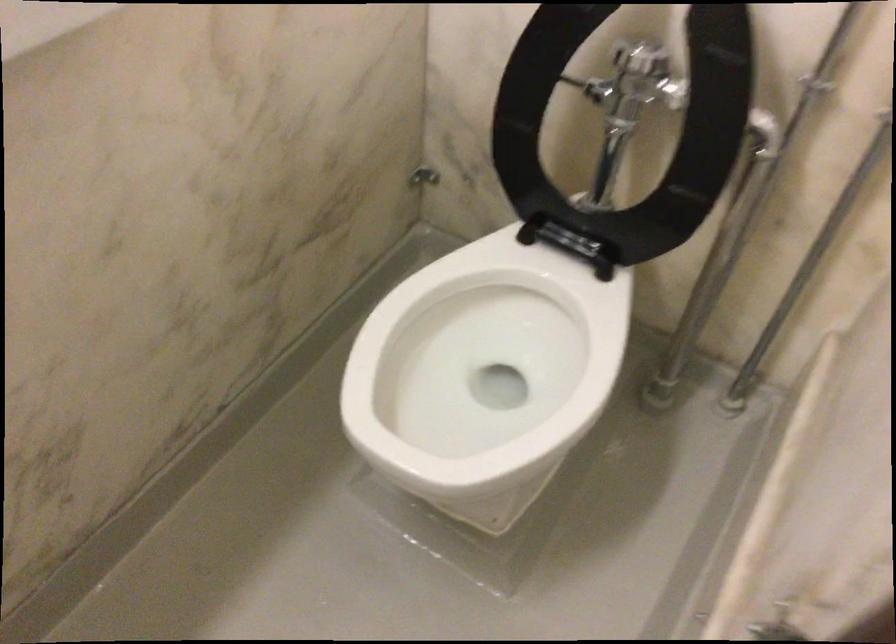
The height and width of the screenshot is (644, 896). Describe the element at coordinates (481, 366) in the screenshot. I see `the black toilet seat` at that location.